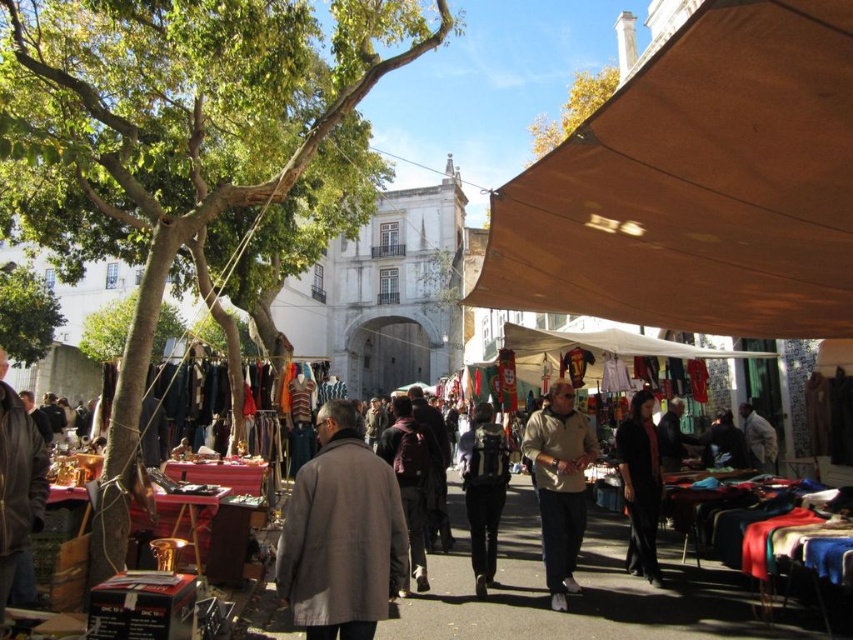
You are standing at the entrance of the market and see the dark gray backpack at center. If you walk straight ahead, will you reach the backpack before reaching the stalls under the large, brown canvas tents?

The dark gray backpack at center is located at point (483, 490). Since the backpack is at the center of the image and the stalls are in the foreground, the backpack is positioned between you and the stalls. Therefore, you will reach the backpack before the stalls.

You are a customer at the market and want to pick up the light brown fabric jacket at center. Can you reach it without moving the matte brown table at center?

The matte brown table at center is located below the light brown fabric jacket at center, so the jacket is above the table. Since the table is below, you can easily reach the jacket without needing to move the table.